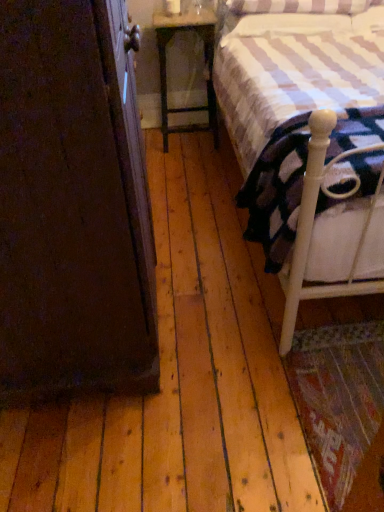
Image resolution: width=384 pixels, height=512 pixels. Find the location of `white wood bed at right`. white wood bed at right is located at coordinates (x=311, y=144).

Identify the location of white soft mattress at right. (276, 191).

Who is shorter, white wood bed at right or wooden nightstand at center?

wooden nightstand at center.

Find the location of a particular element. The image size is (384, 512). nightstand directly beneath the white wood bed at right (from a real-world perspective) is located at coordinates (205, 68).

Is white wood bed at right turned away from wooden nightstand at center?

white wood bed at right does not have its back to wooden nightstand at center.

Can we say white wood bed at right lies outside wooden nightstand at center?

white wood bed at right lies outside wooden nightstand at center's area.

Is white wood bed at right looking in the opposite direction of dark wood armoire at left?

white wood bed at right is not turned away from dark wood armoire at left.

Which object is thinner, white wood bed at right or dark wood armoire at left?

Thinner between the two is dark wood armoire at left.

Looking at this image, who is shorter, white wood bed at right or dark wood armoire at left?

white wood bed at right.

At what (x,y) coordinates should I click in order to perform the action: click on bed on the right of the dark wood armoire at left. Please return your answer as a coordinate pair (x, y). Looking at the image, I should click on (311, 144).

How different are the orientations of white wood bed at right and white soft mattress at right in degrees?

0.000186 degrees separate the facing orientations of white wood bed at right and white soft mattress at right.

Considering the sizes of objects white wood bed at right and white soft mattress at right in the image provided, who is wider, white wood bed at right or white soft mattress at right?

white wood bed at right.

Is white wood bed at right aimed at white soft mattress at right?

Yes, white wood bed at right is aimed at white soft mattress at right.

From the image's perspective, is dark wood armoire at left above or below white wood bed at right?

dark wood armoire at left is situated lower than white wood bed at right in the image.

Considering the relative sizes of dark wood armoire at left and white wood bed at right in the image provided, is dark wood armoire at left taller than white wood bed at right?

Indeed, dark wood armoire at left has a greater height compared to white wood bed at right.

Is dark wood armoire at left next to white wood bed at right and touching it?

dark wood armoire at left is not next to white wood bed at right, and they're not touching.

Is wooden nightstand at center facing away from white soft mattress at right?

No, white soft mattress at right is not at the back of wooden nightstand at center.

From the image's perspective, is wooden nightstand at center on top of white soft mattress at right?

Yes, from the image's perspective, wooden nightstand at center is over white soft mattress at right.

Is wooden nightstand at center placed right next to white soft mattress at right?

No, wooden nightstand at center is not making contact with white soft mattress at right.

Is white soft mattress at right a part of wooden nightstand at center?

That's incorrect, white soft mattress at right is not inside wooden nightstand at center.

Measure the distance from white soft mattress at right to wooden nightstand at center.

4.94 feet.

From a real-world perspective, which object rests below the other?

wooden nightstand at center, from a real-world perspective.

Locate an element on the screen. mattress above the wooden nightstand at center (from a real-world perspective) is located at coordinates [276, 191].

Considering the sizes of white soft mattress at right and wooden nightstand at center in the image, is white soft mattress at right bigger or smaller than wooden nightstand at center?

Clearly, white soft mattress at right is larger in size than wooden nightstand at center.

Is dark wood armoire at left completely or partially outside of wooden nightstand at center?

dark wood armoire at left is positioned outside wooden nightstand at center.

From a real-world perspective, between dark wood armoire at left and wooden nightstand at center, who is vertically lower?

wooden nightstand at center.

Is dark wood armoire at left positioned with its back to wooden nightstand at center?

No, dark wood armoire at left's orientation is not away from wooden nightstand at center.

Identify the location of nightstand behind the white wood bed at right. (205, 68).

Where is `armoire below the white wood bed at right (from the image's perspective)`? This screenshot has width=384, height=512. armoire below the white wood bed at right (from the image's perspective) is located at coordinates (73, 205).

Looking at the image, which one is located closer to dark wood armoire at left, white wood bed at right or white soft mattress at right?

white soft mattress at right lies closer to dark wood armoire at left than the other object.

Estimate the real-world distances between objects in this image. Which object is closer to dark wood armoire at left, wooden nightstand at center or white soft mattress at right?

white soft mattress at right is closer to dark wood armoire at left.

Which object lies further to the anchor point wooden nightstand at center, white wood bed at right or dark wood armoire at left?

dark wood armoire at left.

When comparing their distances from white soft mattress at right, does wooden nightstand at center or dark wood armoire at left seem further?

The object further to white soft mattress at right is wooden nightstand at center.

Looking at the image, which one is located further to wooden nightstand at center, white soft mattress at right or white wood bed at right?

white soft mattress at right lies further to wooden nightstand at center than the other object.

From the image, which object appears to be farther from dark wood armoire at left, white soft mattress at right or white wood bed at right?

white wood bed at right is positioned further to the anchor dark wood armoire at left.

Estimate the real-world distances between objects in this image. Which object is closer to wooden nightstand at center, white wood bed at right or white soft mattress at right?

white wood bed at right lies closer to wooden nightstand at center than the other object.

Consider the image. Looking at the image, which one is located further to wooden nightstand at center, dark wood armoire at left or white soft mattress at right?

dark wood armoire at left lies further to wooden nightstand at center than the other object.

This screenshot has height=512, width=384. Identify the location of mattress between white wood bed at right and wooden nightstand at center from front to back. (276, 191).

You are a GUI agent. You are given a task and a screenshot of the screen. Output one action in this format:
    pyautogui.click(x=<x>, y=<y>)
    Task: Click on the mattress between dark wood armoire at left and white wood bed at right from left to right
    The height and width of the screenshot is (512, 384).
    Given the screenshot: What is the action you would take?
    pyautogui.click(x=276, y=191)

This screenshot has width=384, height=512. Find the location of `bed positioned between dark wood armoire at left and wooden nightstand at center from near to far`. bed positioned between dark wood armoire at left and wooden nightstand at center from near to far is located at coordinates (311, 144).

This screenshot has height=512, width=384. In order to click on mattress between dark wood armoire at left and wooden nightstand at center in the front-back direction in this screenshot , I will do `click(276, 191)`.